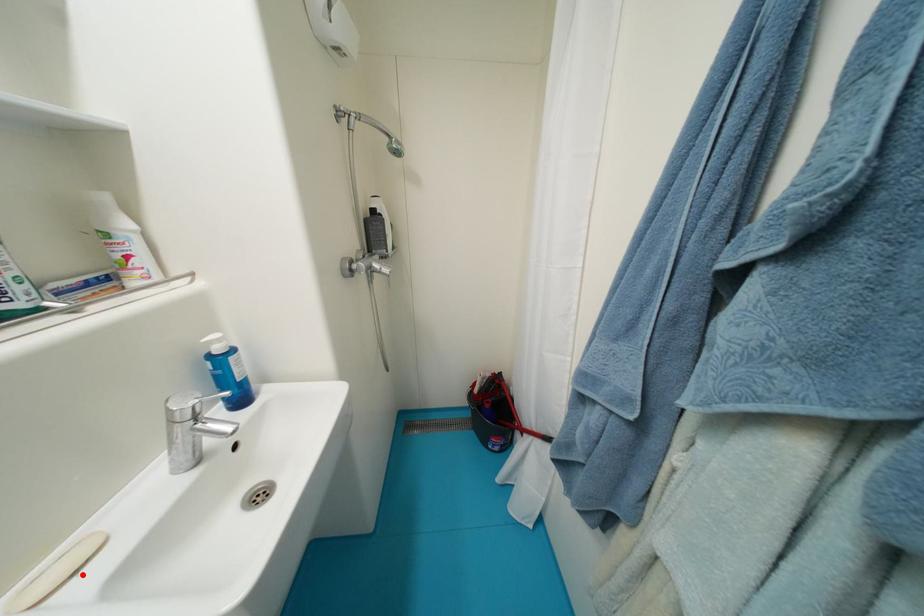
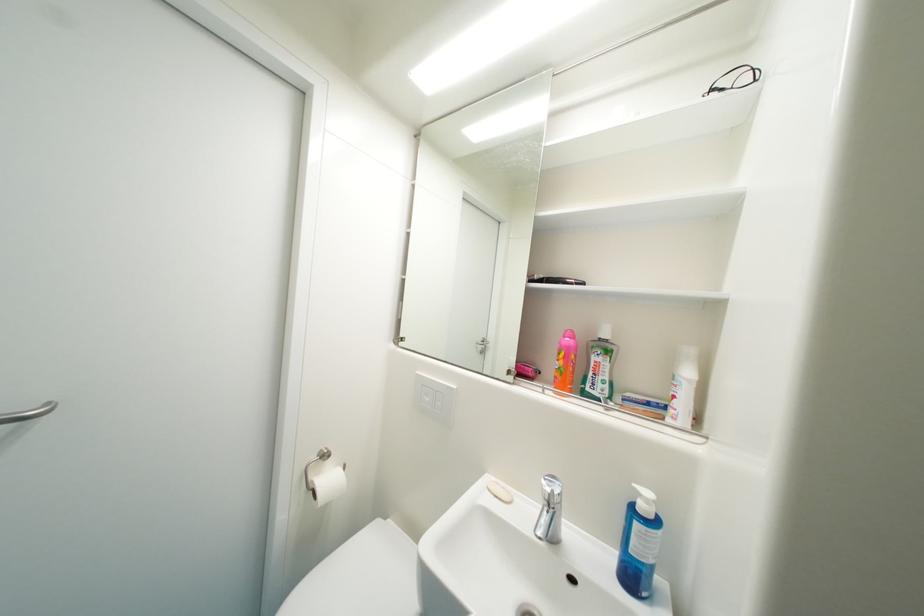
In the second image, find the point that corresponds to the highlighted location in the first image.

(503, 498)